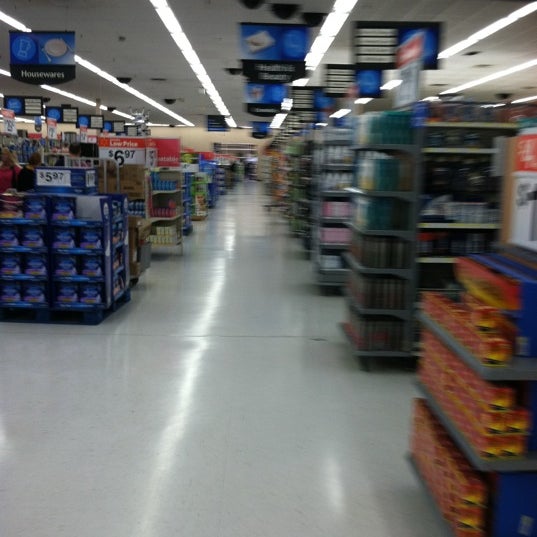
Find the location of a particular element. boxes is located at coordinates (128, 180).